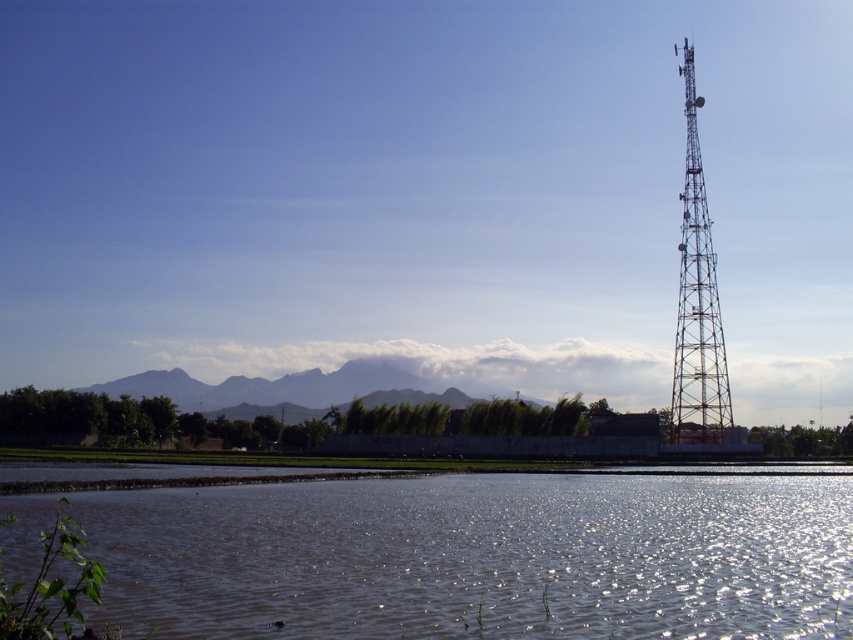
You are a photographer planning to capture the entire scene in one shot. Given that your camera can only focus on objects within a 100m width, and the clear water at lower center and metallic tower at right are the main subjects, will both fit within the camera frame?

The clear water at lower center is larger in size than the metallic tower at right, so it might occupy more space in the frame. However, since the camera can focus on objects within a 100m width, both should fit as long as their combined width doesn

You are standing at the point marked by point (479, 556) in the image. What type of surface are you currently on?

The point (479, 556) corresponds to clear water at lower center, so you are standing on clear water.